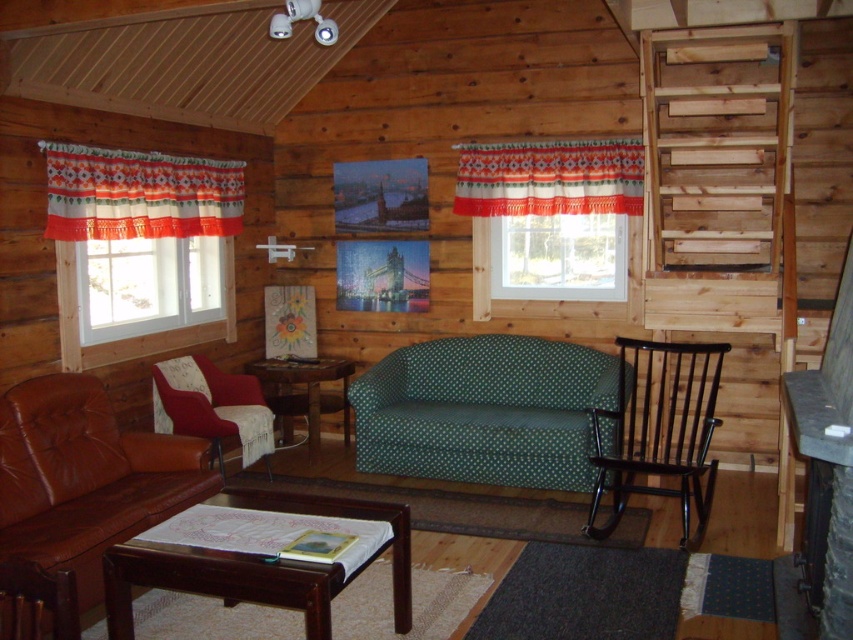
Does brown wooden coffee table at center lie in front of transparent glass window at center?

That is True.

Can you confirm if brown wooden coffee table at center is shorter than transparent glass window at center?

Yes, brown wooden coffee table at center is shorter than transparent glass window at center.

Is point (285, 502) farther from viewer compared to point (608, 228)?

No, (285, 502) is closer to viewer.

Identify the location of brown wooden coffee table at center. (216, 582).

Does brown leather couch at lower left have a lesser height compared to orange and white patterned curtain at left?

Incorrect, brown leather couch at lower left's height does not fall short of orange and white patterned curtain at left's.

Measure the distance between brown leather couch at lower left and orange and white patterned curtain at left.

brown leather couch at lower left is 1.39 meters from orange and white patterned curtain at left.

Is point (99, 598) positioned in front of point (209, 202)?

Yes, it is in front of point (209, 202).

Locate an element on the screen. brown leather couch at lower left is located at coordinates (85, 477).

Is point (695, 381) more distant than point (299, 372)?

No, (695, 381) is closer to viewer.

Who is shorter, black wood rocking chair at lower right or wooden side table at center?

wooden side table at center is shorter.

Which is behind, point (616, 500) or point (288, 397)?

The point (288, 397) is behind.

Where is `black wood rocking chair at lower right`? black wood rocking chair at lower right is located at coordinates (659, 429).